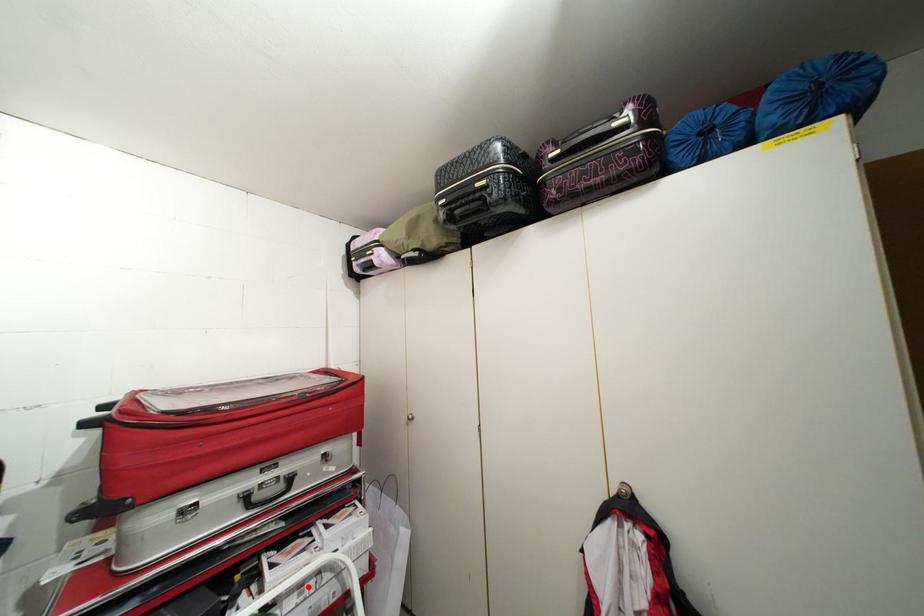
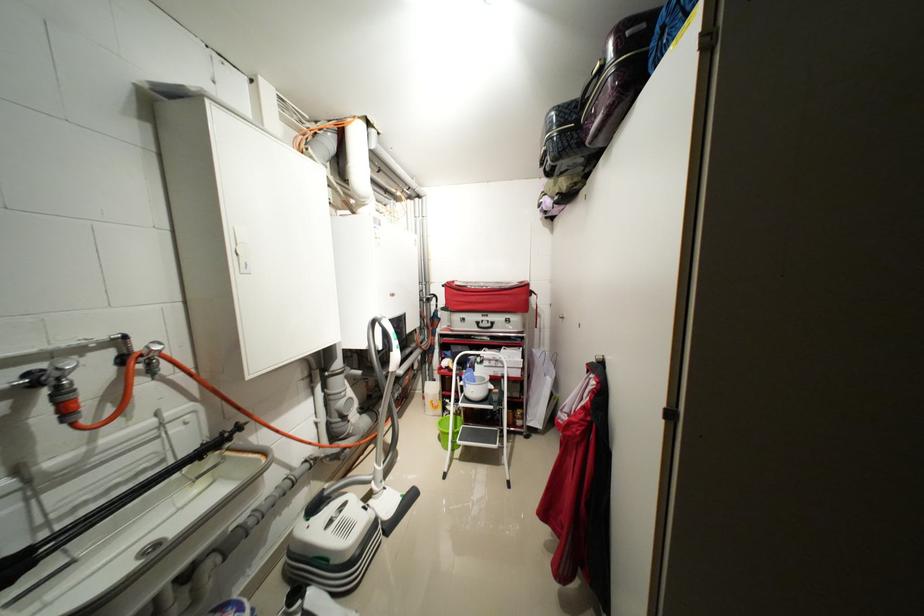
In the second image, find the point that corresponds to the highlighted location in the first image.

(496, 361)